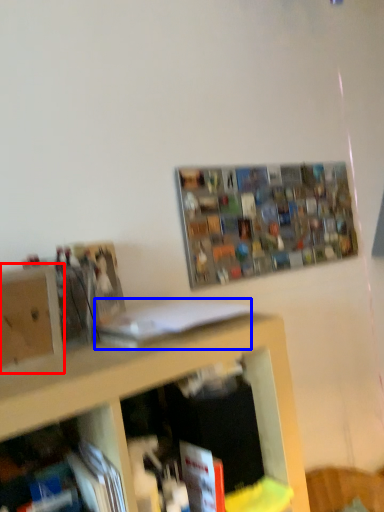
Question: Which point is closer to the camera, cabinet (highlighted by a red box) or book (highlighted by a blue box)?

Choices:
 (A) cabinet
 (B) book

Answer: (A)